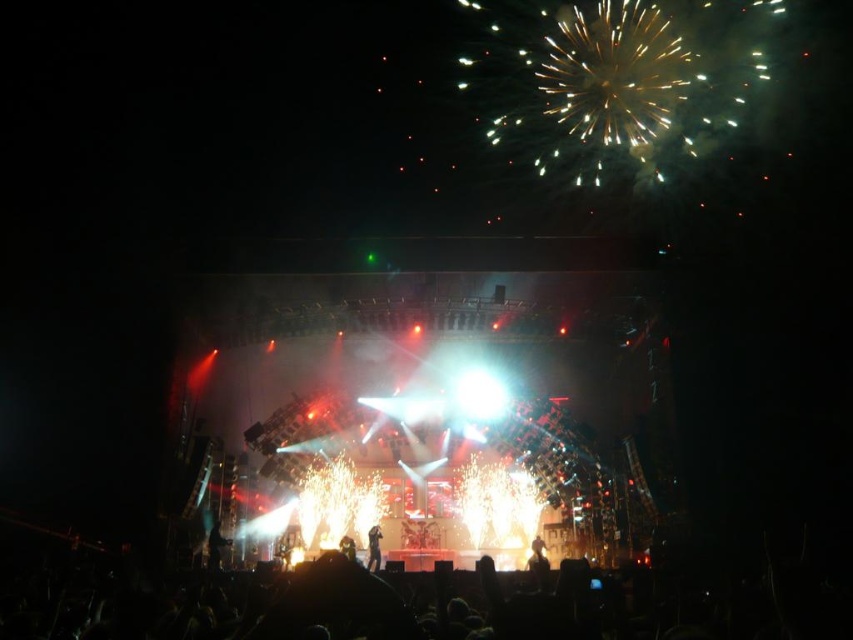
Does black matte crowd at lower center appear on the right side of shiny black suit at center?

Yes, black matte crowd at lower center is to the right of shiny black suit at center.

Is black matte crowd at lower center further to the viewer compared to shiny black suit at center?

No, black matte crowd at lower center is in front of shiny black suit at center.

Is point (318, 636) positioned before point (376, 545)?

Yes, it is in front of point (376, 545).

The image size is (853, 640). Find the location of `black matte crowd at lower center`. black matte crowd at lower center is located at coordinates (389, 604).

Based on the photo, which is more to the right, metallic gold person at center or shiny black suit at center?

Positioned to the right is metallic gold person at center.

Describe the element at coordinates (537, 556) in the screenshot. I see `metallic gold person at center` at that location.

Who is more distant from viewer, [543,566] or [373,547]?

The point [373,547] is behind.

Locate an element on the screen. The image size is (853, 640). metallic gold person at center is located at coordinates (537, 556).

Does point (160, 588) come farther from viewer compared to point (535, 568)?

No, it is not.

Between black matte crowd at lower center and metallic gold person at center, which one appears on the right side from the viewer's perspective?

From the viewer's perspective, metallic gold person at center appears more on the right side.

Find the location of a particular element. The width and height of the screenshot is (853, 640). black matte crowd at lower center is located at coordinates (389, 604).